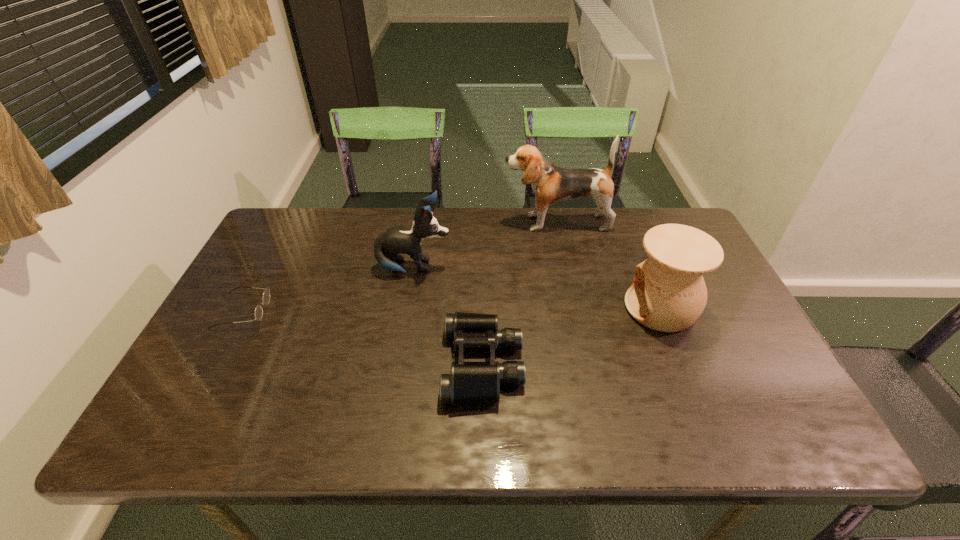
Identify the location of the farthest object. (551, 184).

I want to click on the farther puppy, so click(551, 184).

Identify the location of the nearer puppy. The width and height of the screenshot is (960, 540). click(396, 240).

This screenshot has height=540, width=960. I want to click on the left puppy, so click(396, 240).

This screenshot has width=960, height=540. I want to click on pottery, so [x=668, y=294].

Locate an element on the screen. the fourth tallest object is located at coordinates (470, 382).

Find the location of a particular element. the shortest object is located at coordinates (266, 295).

This screenshot has height=540, width=960. Identify the location of spectacles. (266, 295).

You are a GUI agent. You are given a task and a screenshot of the screen. Output one action in this format:
    pyautogui.click(x=<x>, y=<y>)
    Task: Click on the vacant space located 0.260m at the face of the farthest object
    
    Given the screenshot: What is the action you would take?
    coord(423,222)

This screenshot has height=540, width=960. I want to click on free space located at the face of the farthest object, so click(488, 222).